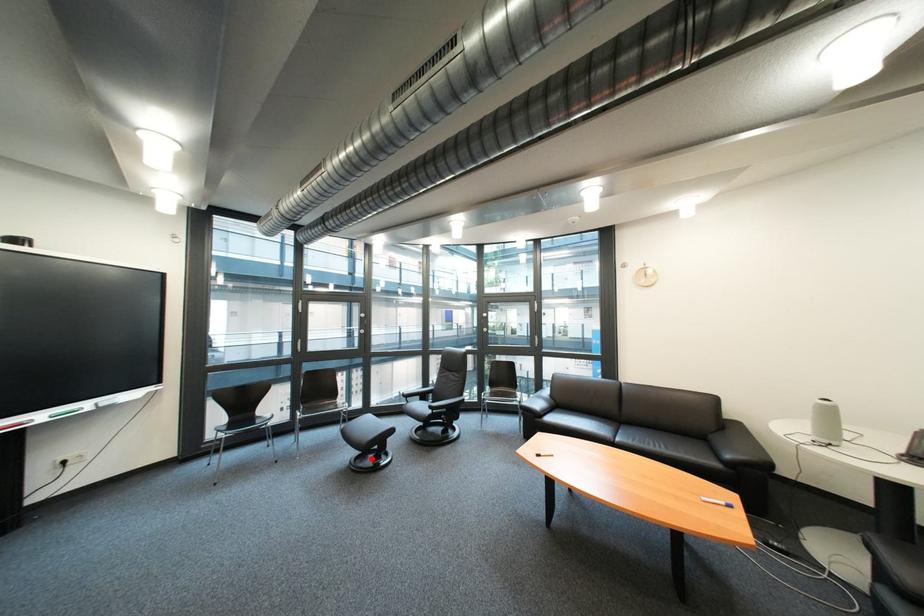
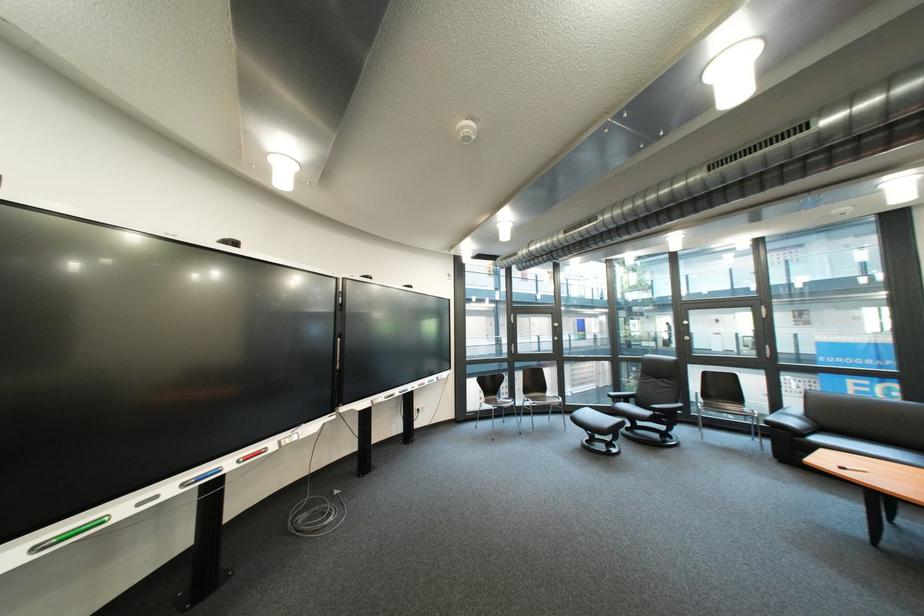
Find the pixel in the second image that matches the highlighted location in the first image.

(601, 443)